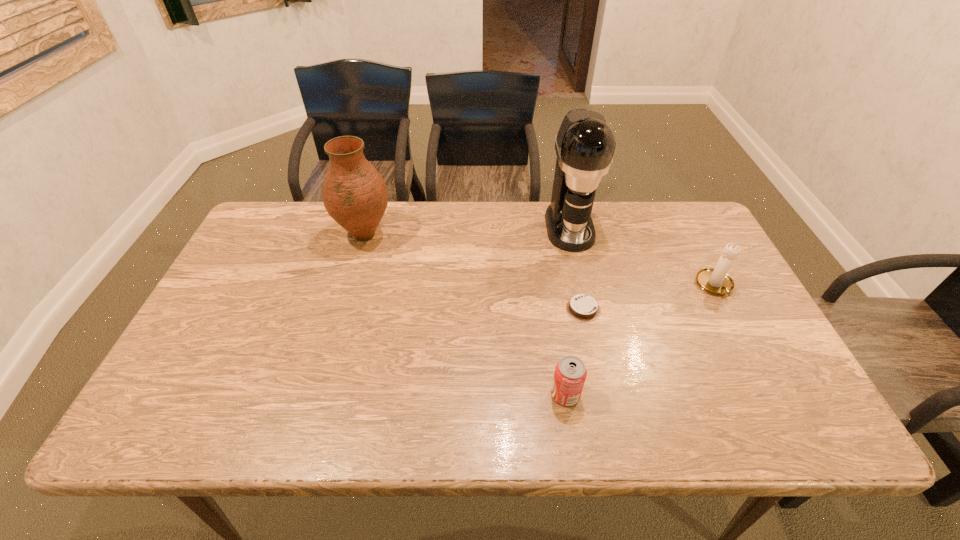
Identify the location of vacant area that lies between the second shortest object and the candle holder. (640, 340).

Select which object appears as the third closest to the second tallest object. Please provide its 2D coordinates. Your answer should be formatted as a tuple, i.e. [(x, y)], where the tuple contains the x and y coordinates of a point satisfying the conditions above.

[(570, 374)]

In order to click on the closest object relative to the rightmost object in this screenshot , I will do `click(585, 144)`.

Locate an element on the screen. free space in the image that satisfies the following two spatial constraints: 1. on the front side of the leftmost object; 2. on the right side of the shortest object is located at coordinates (344, 309).